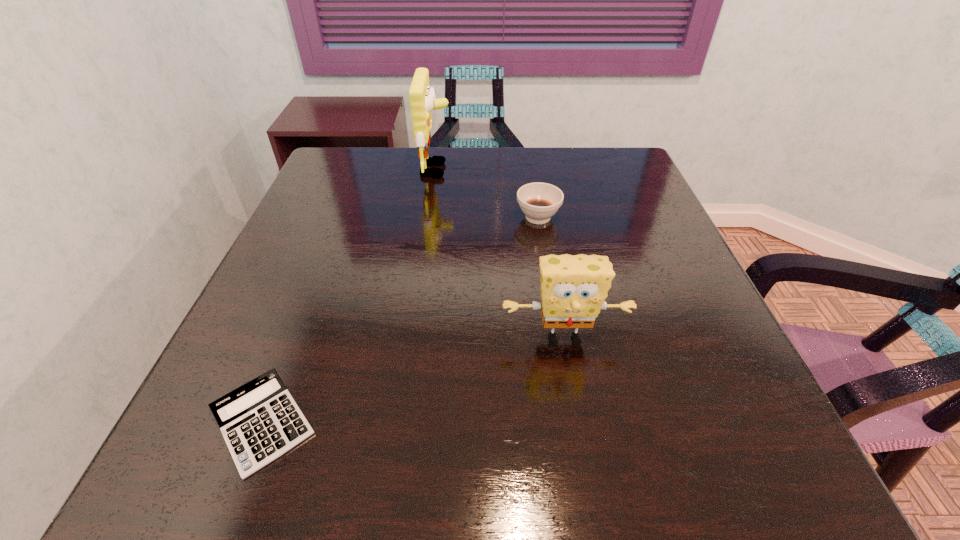
This screenshot has width=960, height=540. What are the coordinates of `vacant area at the far left corner of the desktop` in the screenshot? It's located at (353, 178).

Image resolution: width=960 pixels, height=540 pixels. I want to click on free point at the far right corner, so click(608, 186).

Where is `vacant space at the near right corner of the desktop`? This screenshot has width=960, height=540. vacant space at the near right corner of the desktop is located at coordinates (794, 480).

The height and width of the screenshot is (540, 960). I want to click on free space between the nearest object and the farthest object, so click(349, 296).

Where is `empty location between the third tallest object and the leftmost object`? This screenshot has height=540, width=960. empty location between the third tallest object and the leftmost object is located at coordinates point(400,320).

Where is `vacant region between the shortest object and the second shortest object`? This screenshot has height=540, width=960. vacant region between the shortest object and the second shortest object is located at coordinates (400, 320).

Locate an element on the screen. The height and width of the screenshot is (540, 960). vacant area that lies between the left sponge and the nearer sponge is located at coordinates (500, 254).

Locate an element on the screen. The image size is (960, 540). free space between the third object from right to left and the soup bowl is located at coordinates (487, 193).

Find the location of a particular element. This screenshot has height=540, width=960. free space between the second shortest object and the taller sponge is located at coordinates (487, 193).

Locate an element on the screen. This screenshot has width=960, height=540. empty space that is in between the soup bowl and the leftmost object is located at coordinates (400, 320).